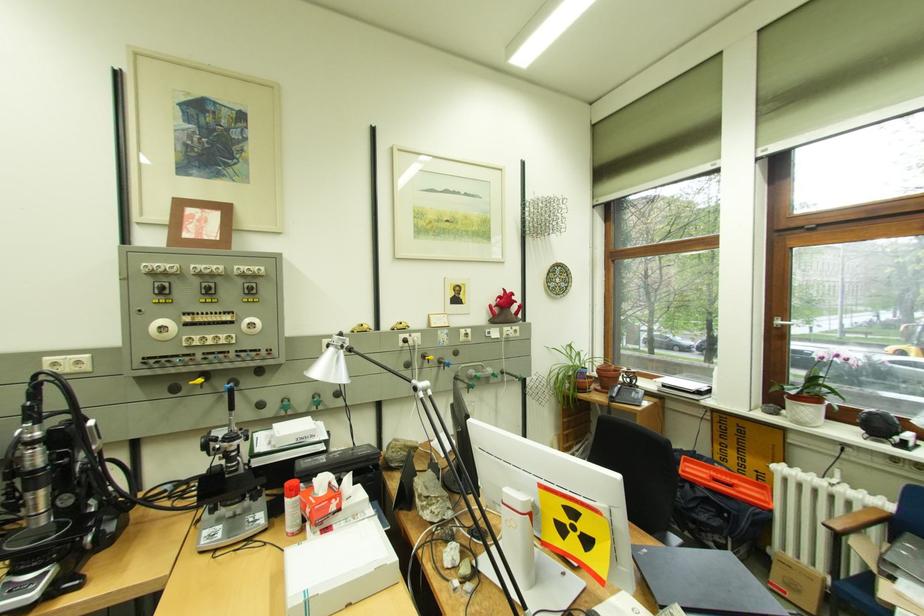
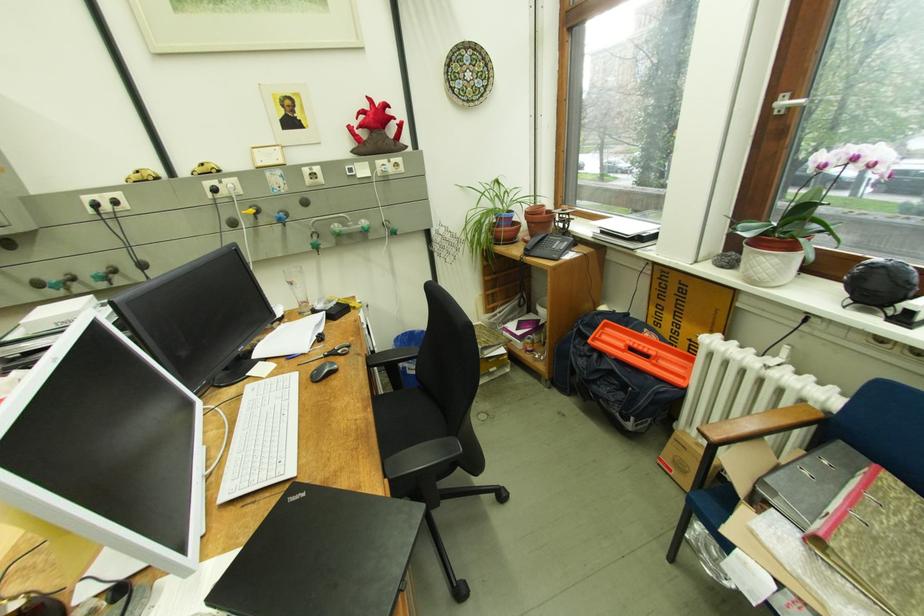
Where in the second image is the point corresponding to point 834,525 from the first image?

(709, 432)